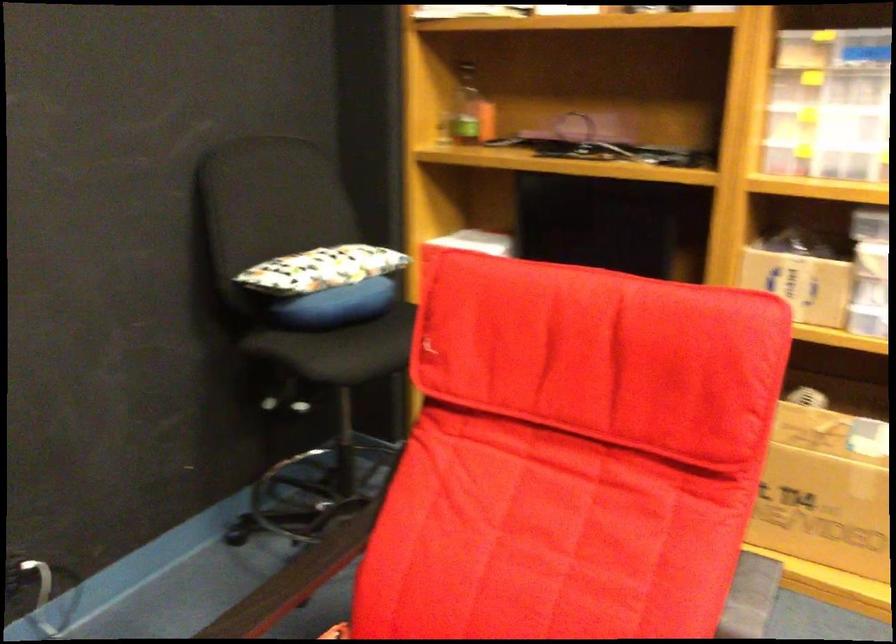
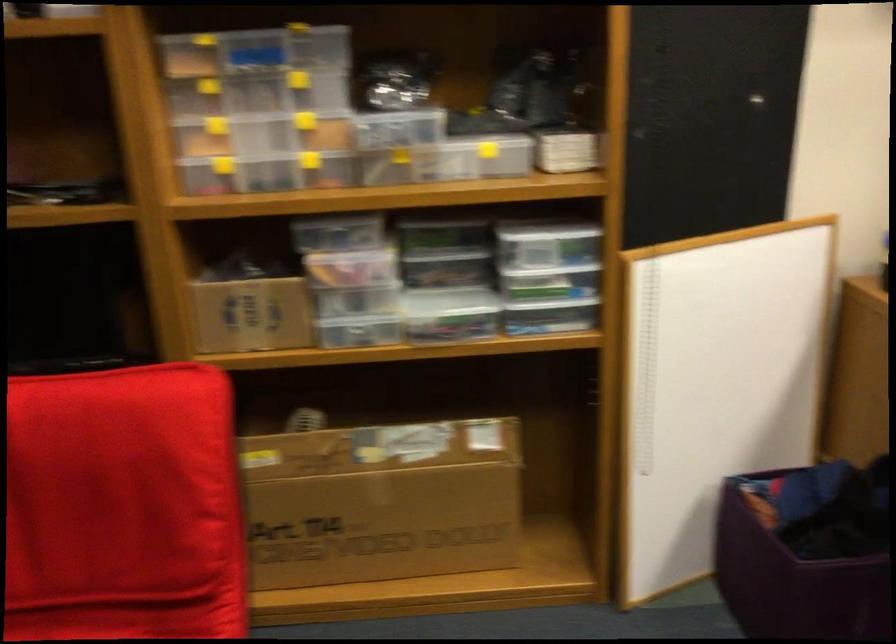
Question: The images are taken continuously from a first-person perspective. In which direction is your viewpoint rotating?

Choices:
 (A) Left
 (B) Right
 (C) Up
 (D) Down

Answer: (B)